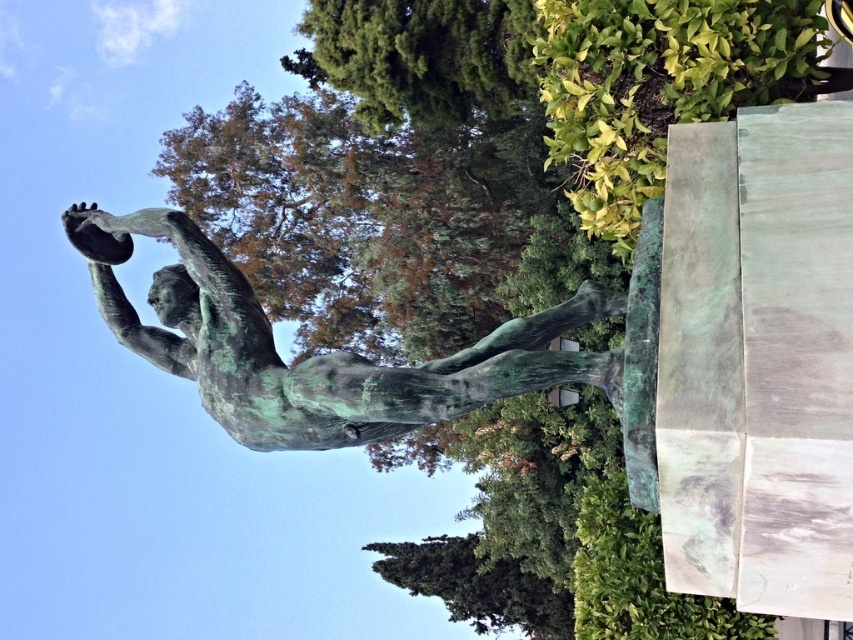
Describe the element at coordinates (421, 56) in the screenshot. I see `green textured tree at upper center` at that location.

Does green textured tree at upper center lie behind green verdigris statue at lower center?

No, it is not.

Between point (345, 42) and point (488, 579), which one is positioned in front?

Point (345, 42)

Identify the location of green textured tree at upper center. The width and height of the screenshot is (853, 640). click(x=421, y=56).

Which is in front, point (363, 374) or point (463, 92)?

Positioned in front is point (363, 374).

Does green patina statue at center have a greater height compared to green textured tree at upper center?

Incorrect, green patina statue at center's height is not larger of green textured tree at upper center's.

Does point (138, 353) come farther from viewer compared to point (437, 49)?

No, it is not.

Where is `green patina statue at center`? This screenshot has width=853, height=640. green patina statue at center is located at coordinates (317, 355).

Does green leafy bush at upper right appear on the left side of green textured tree at upper center?

Incorrect, green leafy bush at upper right is not on the left side of green textured tree at upper center.

Which is behind, point (607, 106) or point (430, 99)?

The point (430, 99) is more distant.

Does point (814, 0) lie behind point (454, 116)?

No.

The height and width of the screenshot is (640, 853). In order to click on green leafy bush at upper right in this screenshot , I will do (x=659, y=86).